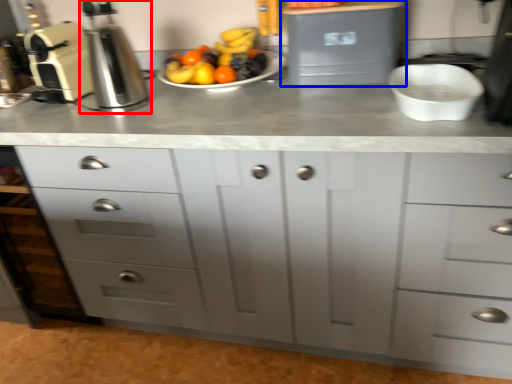
Question: Which point is further to the camera, coffee machine (highlighted by a red box) or appliance (highlighted by a blue box)?

Choices:
 (A) coffee machine
 (B) appliance

Answer: (B)